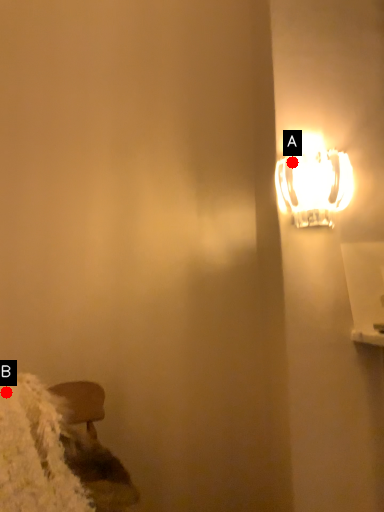
Question: Two points are circled on the image, labeled by A and B beside each circle. Which point is closer to the camera?

Choices:
 (A) A is closer
 (B) B is closer

Answer: (B)